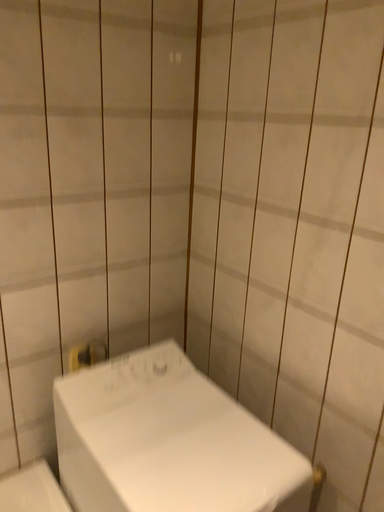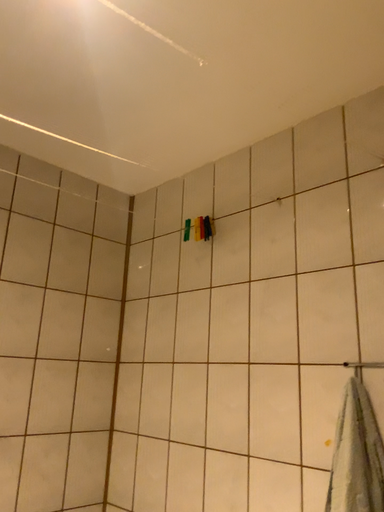
Question: Which way did the camera rotate in the video?

Choices:
 (A) rotated upward
 (B) rotated downward

Answer: (A)